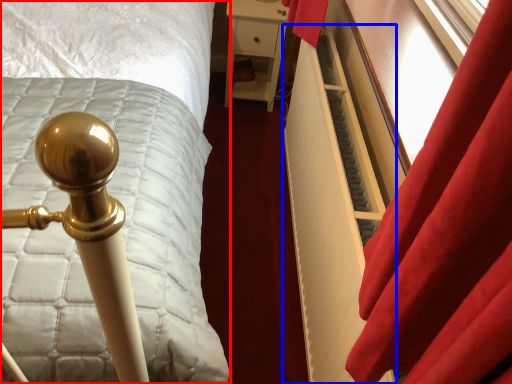
Question: Which of the following is the farthest to the observer, bed (highlighted by a red box) or radiator (highlighted by a blue box)?

Choices:
 (A) bed
 (B) radiator

Answer: (A)